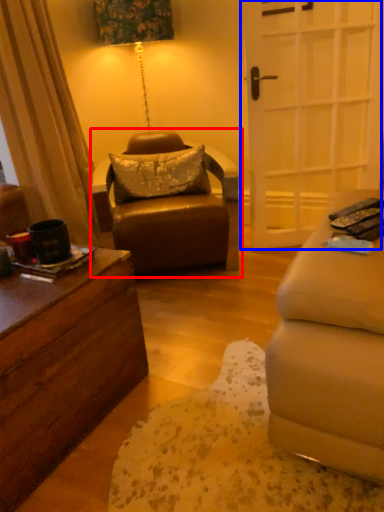
Question: Which point is further to the camera, chair (highlighted by a red box) or door (highlighted by a blue box)?

Choices:
 (A) chair
 (B) door

Answer: (B)